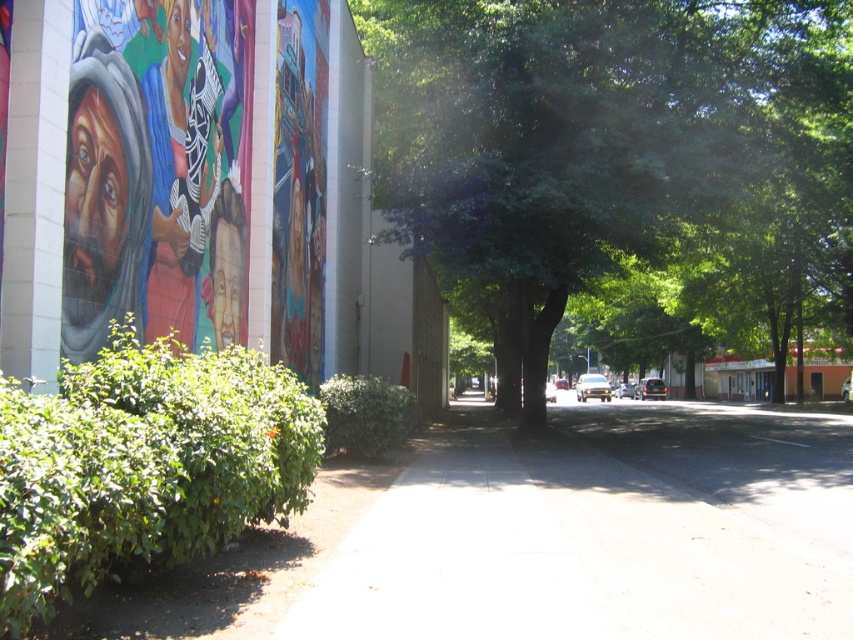
Question: In this image, where is green leafy tree at center located relative to gray concrete sidewalk at center?

Choices:
 (A) left
 (B) right

Answer: (B)

Question: Which of the following is the farthest from the observer?

Choices:
 (A) (482, 237)
 (B) (585, 449)

Answer: (B)

Question: Which of the following is the closest to the observer?

Choices:
 (A) green leafy tree at center
 (B) gray concrete sidewalk at center

Answer: (B)

Question: Is green leafy tree at center below gray concrete sidewalk at center?

Choices:
 (A) no
 (B) yes

Answer: (A)

Question: Considering the relative positions of green leafy tree at center and gray concrete sidewalk at center in the image provided, where is green leafy tree at center located with respect to gray concrete sidewalk at center?

Choices:
 (A) right
 (B) left

Answer: (A)